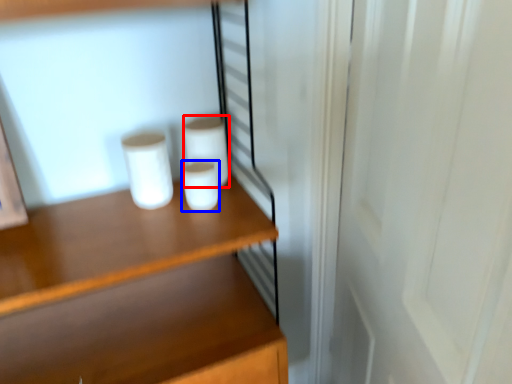
Question: Which object is further to the camera taking this photo, paper towel (highlighted by a red box) or paper towel (highlighted by a blue box)?

Choices:
 (A) paper towel
 (B) paper towel

Answer: (A)